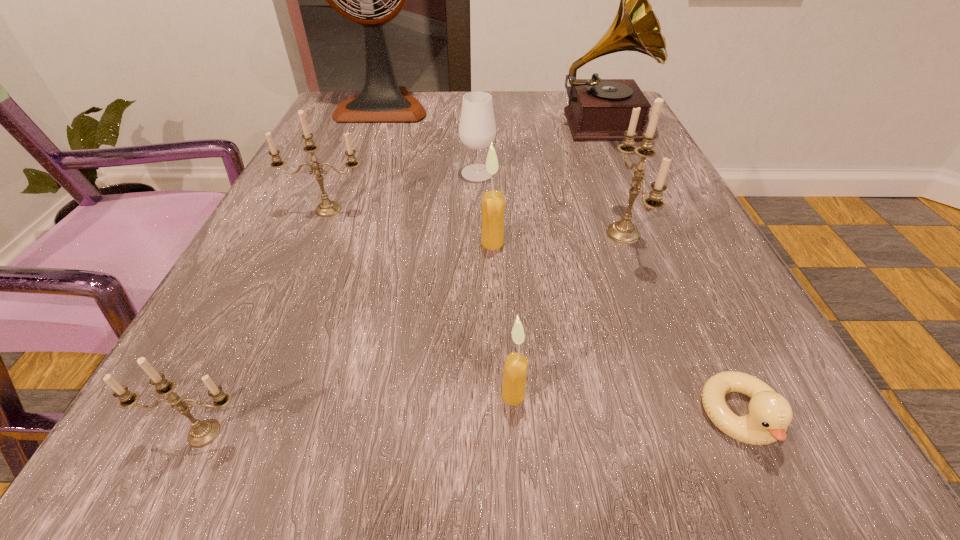
The width and height of the screenshot is (960, 540). What are the coordinates of `object that is at the far left corner` in the screenshot? It's located at (381, 100).

At what (x,y) coordinates should I click in order to perform the action: click on object that is at the near left corner. Please return your answer as a coordinate pair (x, y). Looking at the image, I should click on click(x=202, y=433).

Identify the location of object positioned at the far right corner. (x=599, y=109).

Where is `object that is at the near right corner`? object that is at the near right corner is located at coordinates (770, 414).

Where is `vacant region at the far edge`? vacant region at the far edge is located at coordinates (420, 96).

You are a GUI agent. You are given a task and a screenshot of the screen. Output one action in this format:
    pyautogui.click(x=<x>, y=<y>)
    Task: Click on the free space at the near edge of the desktop
    This screenshot has height=540, width=960.
    Given the screenshot: What is the action you would take?
    pyautogui.click(x=485, y=454)

Locate an element on the screen. vacant space at the left edge of the desktop is located at coordinates (344, 202).

Identify the location of vacant space at the right edge of the desktop. The height and width of the screenshot is (540, 960). (698, 290).

In the image, there is a desktop. In order to click on free space at the far left corner in this screenshot , I will do `click(388, 129)`.

Locate an element on the screen. free space at the near left corner of the desktop is located at coordinates (219, 451).